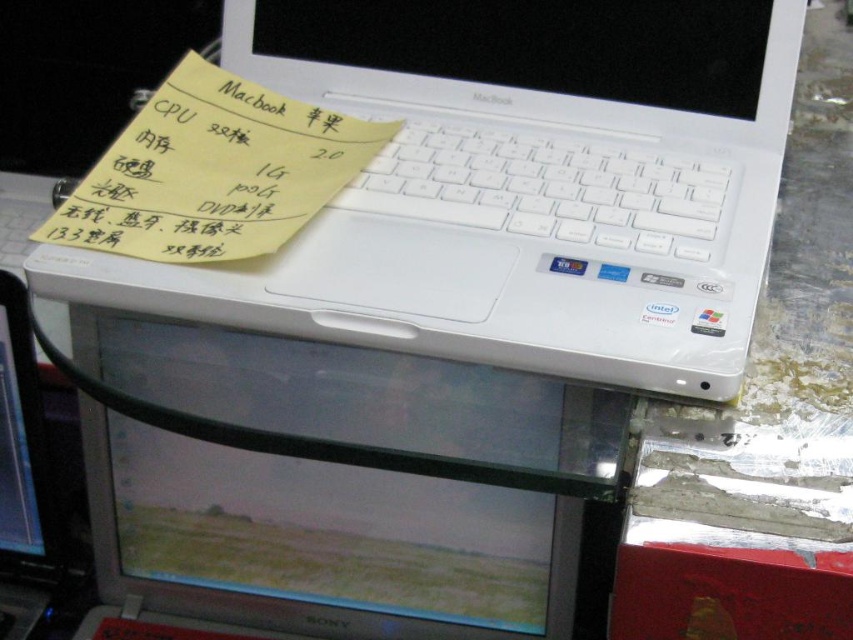
Does matte plastic monitor at center have a smaller size compared to yellow paper at upper left?

Incorrect, matte plastic monitor at center is not smaller in size than yellow paper at upper left.

Between point (120, 579) and point (170, 138), which one is positioned in front?

Positioned in front is point (170, 138).

Identify the location of matte plastic monitor at center. This screenshot has width=853, height=640. (335, 486).

Does white plastic laptop at upper center lie behind white plastic laptop at lower left?

No, white plastic laptop at upper center is closer to the viewer.

Does point (535, 109) come closer to viewer compared to point (6, 321)?

Yes, point (535, 109) is closer to viewer.

This screenshot has height=640, width=853. What are the coordinates of `white plastic laptop at upper center` in the screenshot? It's located at 535,179.

In the scene shown: Is matte plastic monitor at center positioned before white plastic laptop at lower left?

Yes, matte plastic monitor at center is closer to the viewer.

What do you see at coordinates (335, 486) in the screenshot? I see `matte plastic monitor at center` at bounding box center [335, 486].

This screenshot has height=640, width=853. What are the coordinates of `matte plastic monitor at center` in the screenshot? It's located at (335, 486).

Identify the location of matte plastic monitor at center. This screenshot has height=640, width=853. (335, 486).